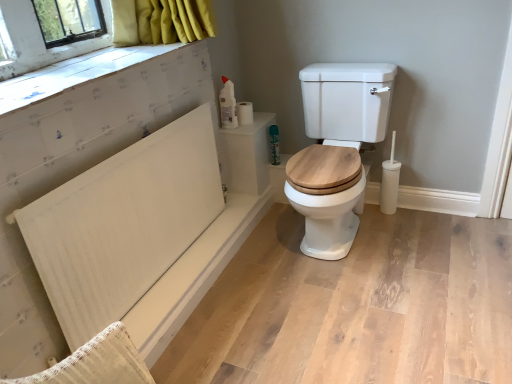
I want to click on vacant space in front of white wood toilet at center, so [364, 300].